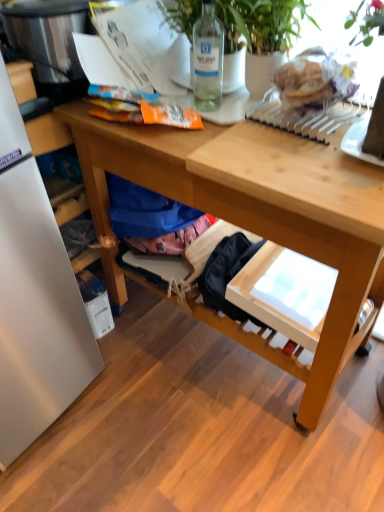
Identify the location of free space in front of clear glass bottle at upper center. The height and width of the screenshot is (512, 384). (196, 132).